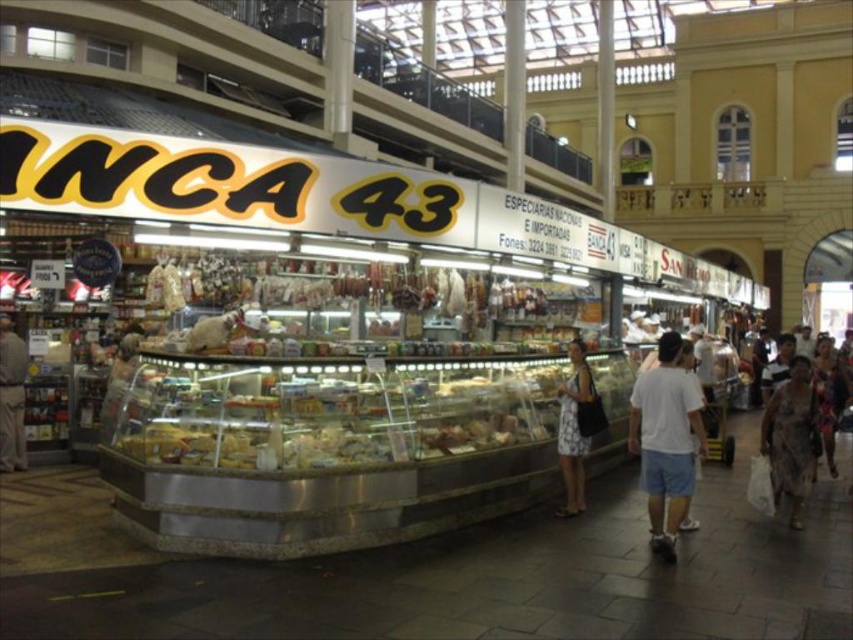
Consider the image. You are a customer in the market and want to reach the patterned fabric dress at lower right. Which direction should you move from the white floral dress at center?

The patterned fabric dress at lower right is located below the white floral dress at center, so you should move downward to reach it.

You are standing in the market and want to take a photo of the point at coordinates [573,417]. Given that your camera has a minimum focus distance of 3 meters, will you be able to focus on that point?

The distance of point [573,417] from the viewer is 34.40 meters, which is greater than the camera minimum focus distance of 3 meters. Therefore, the camera can focus on that point.

You are a customer in the market and want to choose between the patterned fabric dress at lower right and the white floral dress at center. Which dress is shorter in height?

The patterned fabric dress at lower right is not as tall as the white floral dress at center, so the patterned fabric dress at lower right is shorter in height.